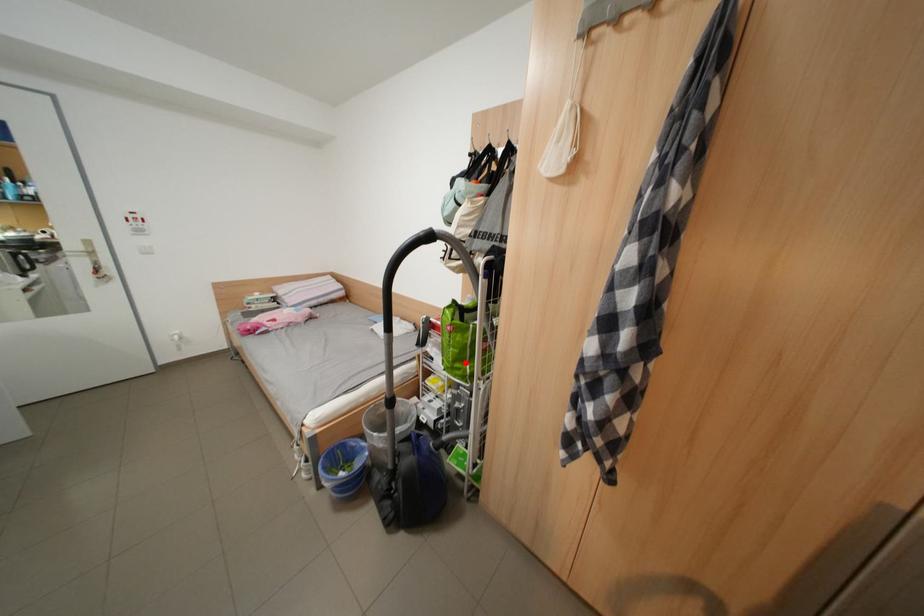
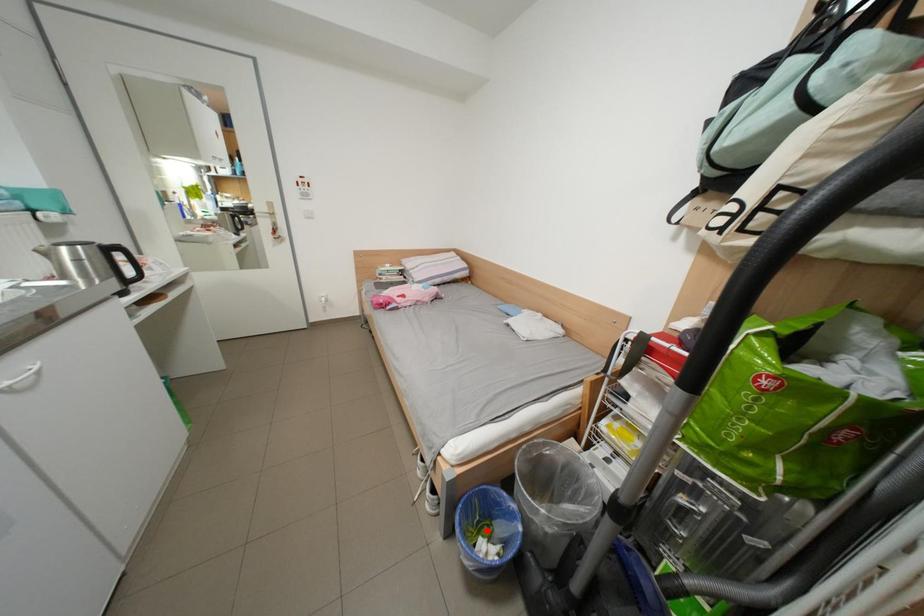
I am providing you with two images of the same scene from different viewpoints. A red point is marked on the first image and another point is marked on the second image. Do the highlighted points in image1 and image2 indicate the same real-world spot?

No